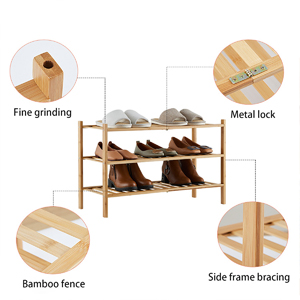
I want to click on shoes on top shelf, so tap(118, 119), tap(134, 118), tap(169, 115), tap(191, 114).